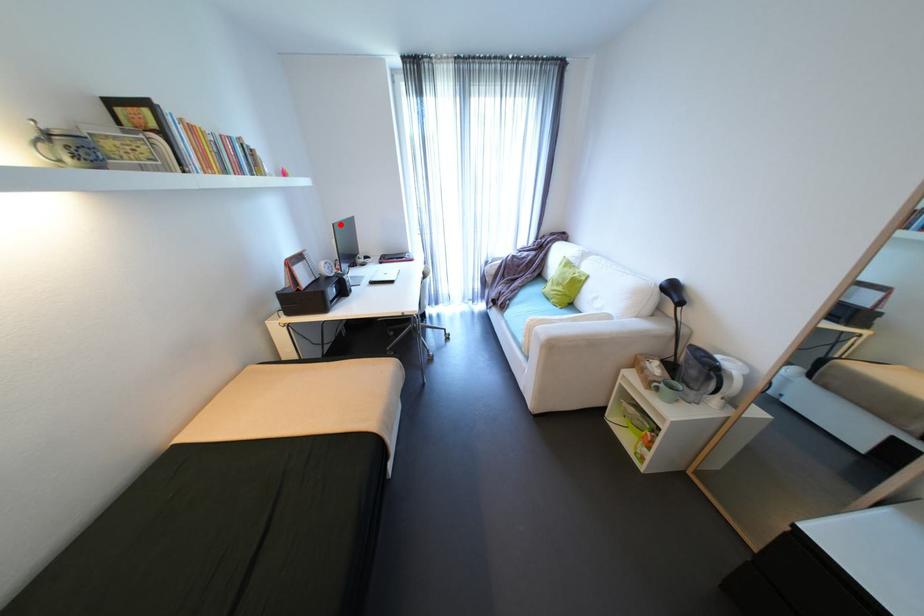
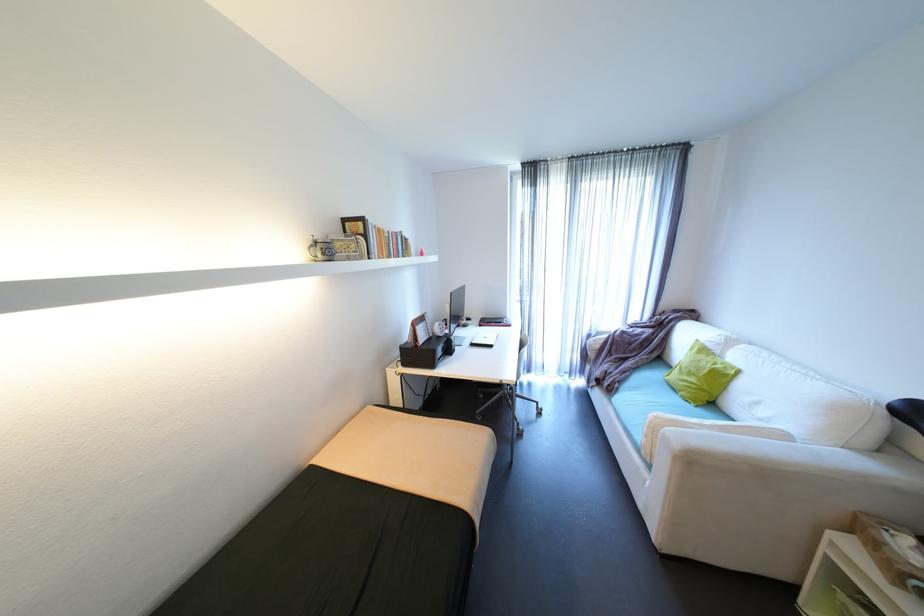
In the second image, find the point that corresponds to the highlighted location in the first image.

(458, 294)